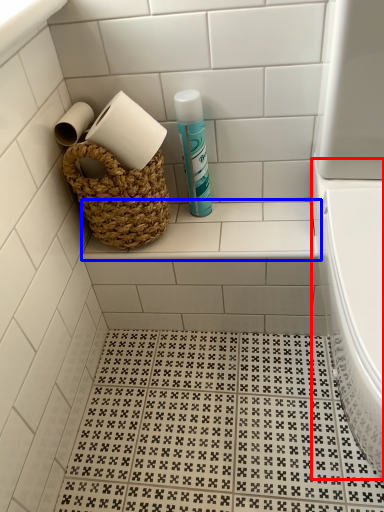
Question: Which of the following is the closest to the observer, bath (highlighted by a red box) or ledge (highlighted by a blue box)?

Choices:
 (A) bath
 (B) ledge

Answer: (A)